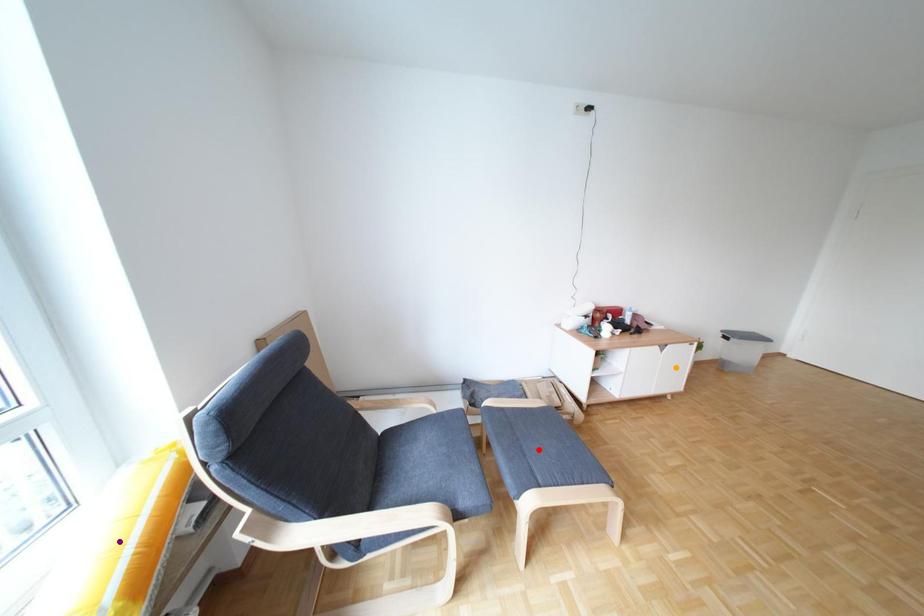
Order these from nearest to farthest:
purple point
orange point
red point

purple point
red point
orange point